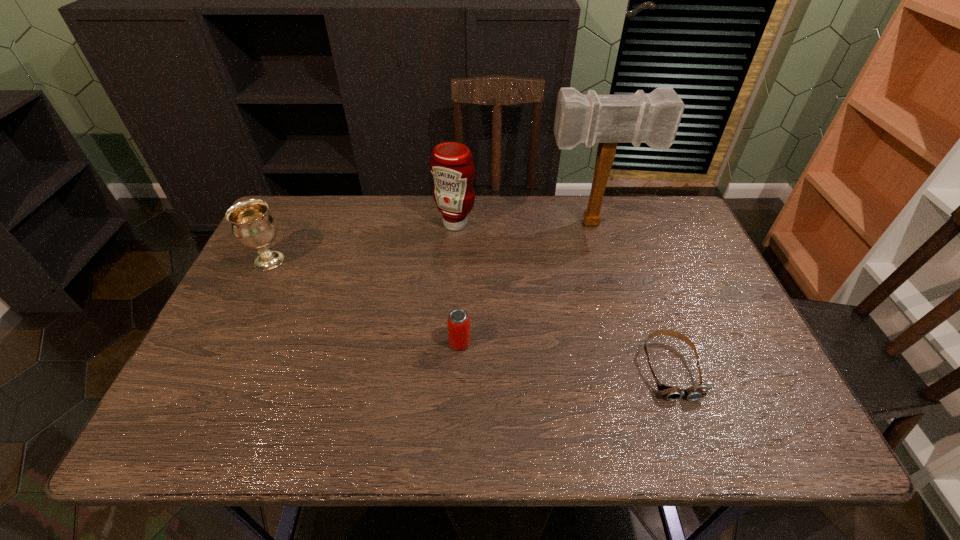
This screenshot has width=960, height=540. Find the location of `vacant space situated on the front-facing side of the shortest object`. vacant space situated on the front-facing side of the shortest object is located at coordinates (693, 432).

Where is `mallet located at the far edge`? The width and height of the screenshot is (960, 540). mallet located at the far edge is located at coordinates (653, 119).

At what (x,y) coordinates should I click in order to perform the action: click on condiment that is at the far edge. Please return your answer as a coordinate pair (x, y). The height and width of the screenshot is (540, 960). Looking at the image, I should click on (x=451, y=164).

This screenshot has height=540, width=960. Find the location of `object that is at the left edge`. object that is at the left edge is located at coordinates (253, 226).

Locate an element on the screen. mallet located at the right edge is located at coordinates (653, 119).

You are a GUI agent. You are given a task and a screenshot of the screen. Output one action in this format:
    pyautogui.click(x=<x>, y=<y>)
    Task: Click on the goggles that is positioned at the right edge
    
    Given the screenshot: What is the action you would take?
    pyautogui.click(x=671, y=393)

Image resolution: width=960 pixels, height=540 pixels. What are the coordinates of `object at the far right corner` in the screenshot? It's located at (653, 119).

In the image, there is a desktop. Identify the location of vacant area at the far edge. (344, 217).

Locate an element on the screen. The height and width of the screenshot is (540, 960). free space at the near edge of the desktop is located at coordinates click(x=664, y=409).

Locate an element on the screen. The image size is (960, 540). free space at the left edge of the desktop is located at coordinates (292, 267).